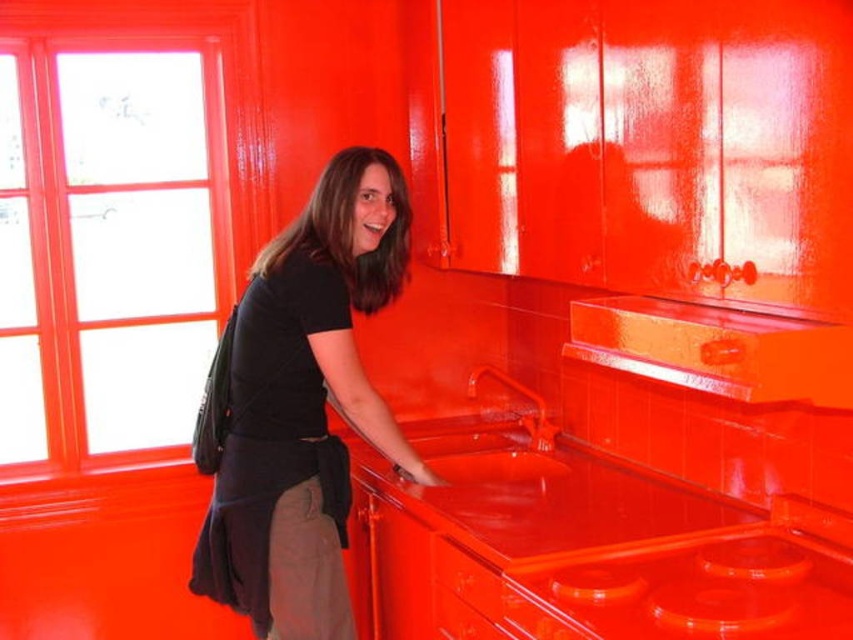
You are a painter who needs to place a 15 cm tall vase on the glossy orange countertop at lower center. Considering the height of the matte black shirt at center, will the vase be visible from the front of the countertop?

The glossy orange countertop at lower center has a lesser height compared to the matte black shirt at center. Since the countertop is shorter than the shirt, the 15 cm tall vase placed on it would likely be visible from the front as the shirt does not obstruct the view.

You are a delivery person standing at the entrance of the room. You need to place a package that requires a flat surface. The package is 1.5 meters long. Can you place it on the glossy orange countertop at lower center without it hanging off the edge?

The glossy orange countertop at lower center is 1.53 meters away from the viewer. Since the package is 1.5 meters long, it can be placed on the countertop without hanging off the edge as the countertop is slightly longer than the package.

You are a painter who just finished painting the room red. You notice the glossy orange countertop at lower center and the matte black shirt at center. Which object is more to the right?

The glossy orange countertop at lower center is positioned on the right side of the matte black shirt at center, so it is more to the right.